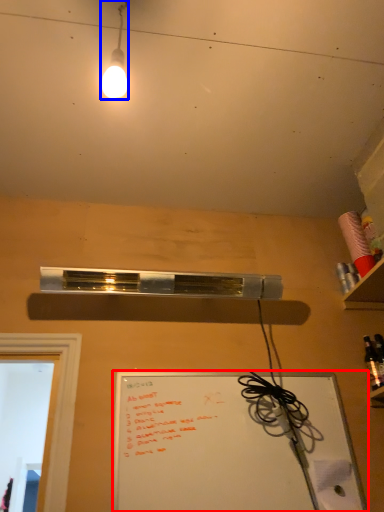
Question: Which of the following is the closest to the observer, whiteboard (highlighted by a red box) or lamp (highlighted by a blue box)?

Choices:
 (A) whiteboard
 (B) lamp

Answer: (B)